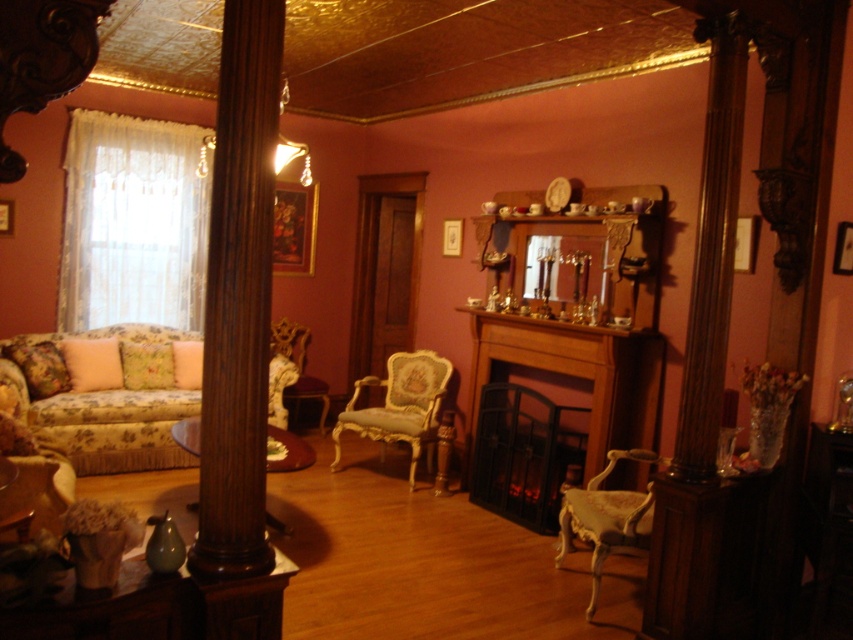
You are planning to place a new rectangular rug in the living room. The rug is 2 meters wide. You want to place it between the wooden fireplace at center and the velvet gold armchair at lower left. Can the rug fit between them if the space between them is exactly the same as the rug width?

The wooden fireplace at center is wider than the velvet gold armchair at lower left. However, the question states that the space between them is exactly the same as the rug width. Since the space matches the rug width of 2 meters, the rug can fit between them.

You are standing in the vintage living room and want to place a 10 feet long sofa between the wooden fireplace at center and the velvet gold armchair at lower left. Can the sofa fit in the space between them?

The wooden fireplace at center is 8.95 feet away from the velvet gold armchair at lower left. Since the sofa is 10 feet long, it cannot fit in the space between them as the distance is shorter than the sofa length.

You are standing in the vintage living room and want to check the position of the white lace curtain at left. Where exactly is it located in the room?

The white lace curtain at left is located at point (132, 224) in the room.